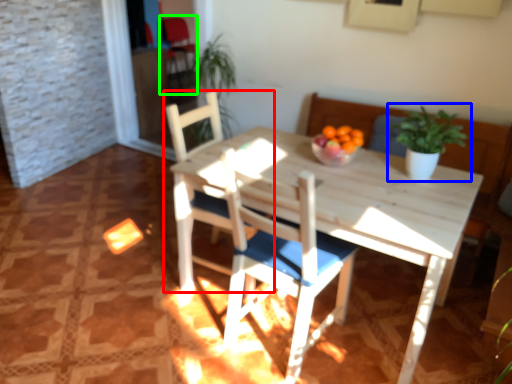
Question: Estimate the real-world distances between objects in this image. Which object is closer to chair (highlighted by a red box), houseplant (highlighted by a blue box) or armchair (highlighted by a green box)?

Choices:
 (A) houseplant
 (B) armchair

Answer: (A)